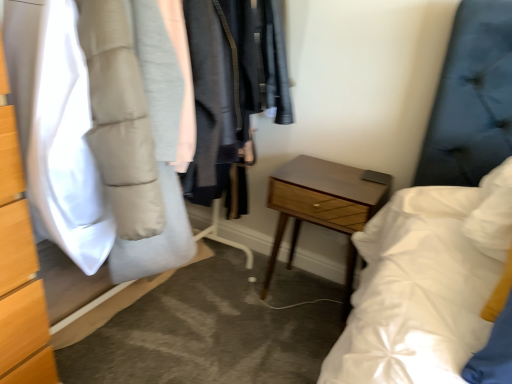
The height and width of the screenshot is (384, 512). In order to click on vacant space positioned to the left of woodenmaterial/texturenightstand at center in this screenshot , I will do `click(244, 292)`.